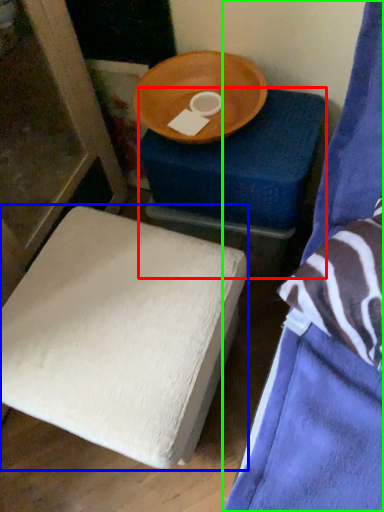
Question: Which is farther away from furniture (highlighted by a red box)? furniture (highlighted by a blue box) or furniture (highlighted by a green box)?

Choices:
 (A) furniture
 (B) furniture

Answer: (A)